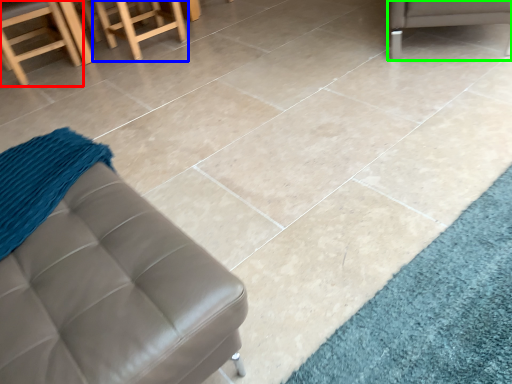
Question: Estimate the real-world distances between objects in this image. Which object is closer to chair (highlighted by a red box), stool (highlighted by a blue box) or furniture (highlighted by a green box)?

Choices:
 (A) stool
 (B) furniture

Answer: (A)